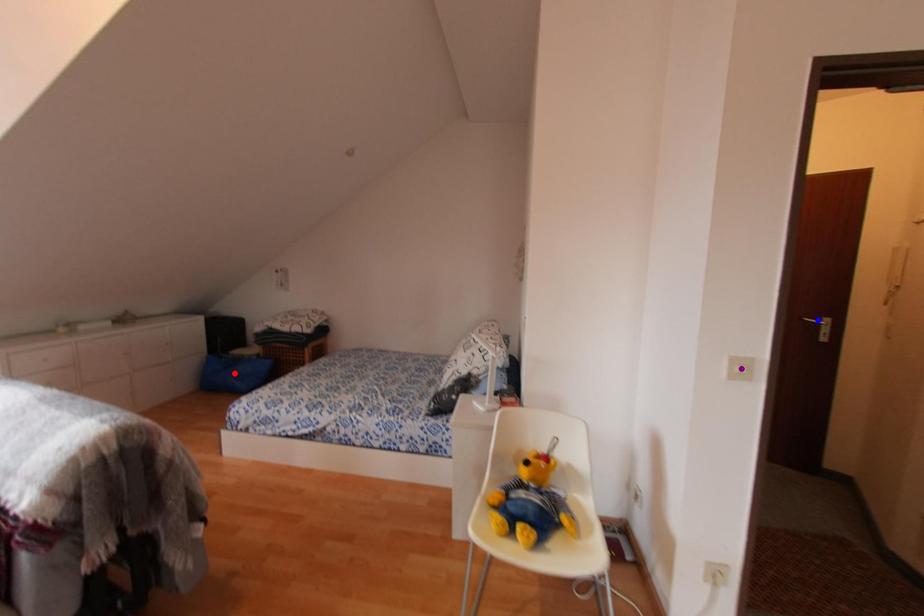
In the scene shown: Order these from nearest to farthest:
purple point | red point | blue point

purple point < blue point < red point